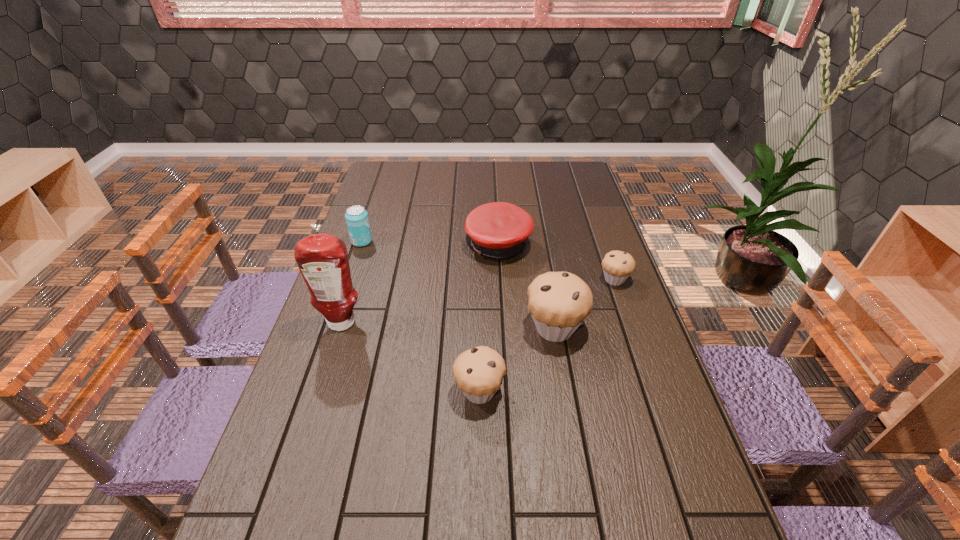
Find the location of a particular element. The image size is (960, 540). the nearest muffin is located at coordinates (479, 371).

This screenshot has width=960, height=540. Find the location of `the second tallest muffin`. the second tallest muffin is located at coordinates (479, 371).

Find the location of a particular element. the second tallest object is located at coordinates (558, 302).

At what (x,y) coordinates should I click in order to perform the action: click on the second farthest muffin. Please return your answer as a coordinate pair (x, y). This screenshot has height=540, width=960. Looking at the image, I should click on (558, 302).

Locate an element on the screen. the shortest object is located at coordinates click(617, 265).

Locate an element on the screen. The width and height of the screenshot is (960, 540). the farthest muffin is located at coordinates (617, 265).

You are a GUI agent. You are given a task and a screenshot of the screen. Output one action in this format:
    pyautogui.click(x=<x>, y=<y>)
    Task: Click on the beer can
    The width and height of the screenshot is (960, 540).
    Given the screenshot: What is the action you would take?
    pyautogui.click(x=357, y=220)

Find the location of a particular element. This screenshot has height=540, width=960. condiment is located at coordinates (322, 259).

You are a GUI agent. You are given a task and a screenshot of the screen. Output one action in this format:
    pyautogui.click(x=<x>, y=<y>)
    Task: Click on the cap
    This screenshot has width=960, height=540.
    Given the screenshot: What is the action you would take?
    pyautogui.click(x=499, y=230)

At what (x,y) coordinates should I click in order to perform the action: click on vacant space located 0.290m on the left of the leftmost muffin. Please return your answer as a coordinate pair (x, y). The height and width of the screenshot is (540, 960). Looking at the image, I should click on (333, 392).